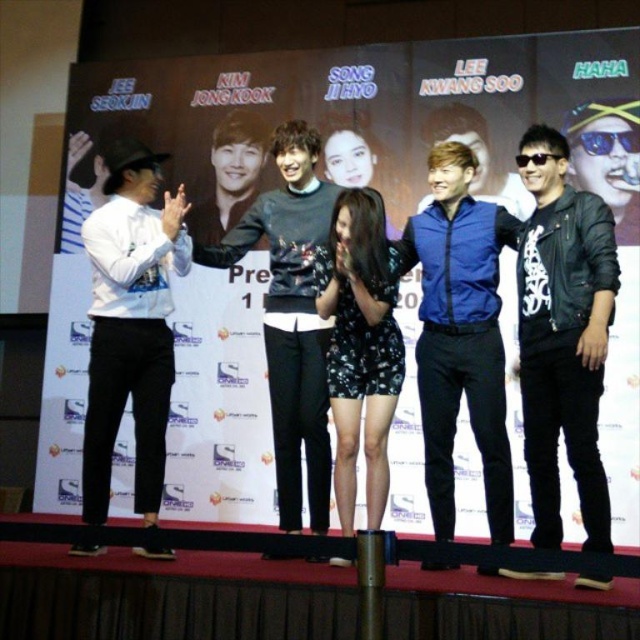
Question: Is black leather jacket at right thinner than white matte shirt at left?

Choices:
 (A) no
 (B) yes

Answer: (B)

Question: Can you confirm if white matte shirt at left is positioned below dark gray sweater at center?

Choices:
 (A) no
 (B) yes

Answer: (B)

Question: Is white matte shirt at left smaller than dark gray sweater at center?

Choices:
 (A) yes
 (B) no

Answer: (A)

Question: Which object is the farthest from the white matte shirt at left?

Choices:
 (A) black leather jacket at right
 (B) dark gray sweater at center

Answer: (A)

Question: Which point is farther from the camera taking this photo?

Choices:
 (A) (564, 221)
 (B) (292, 476)
 (C) (140, 428)

Answer: (B)

Question: Among these points, which one is nearest to the camera?

Choices:
 (A) (524, 356)
 (B) (164, 337)
 (C) (308, 275)

Answer: (A)